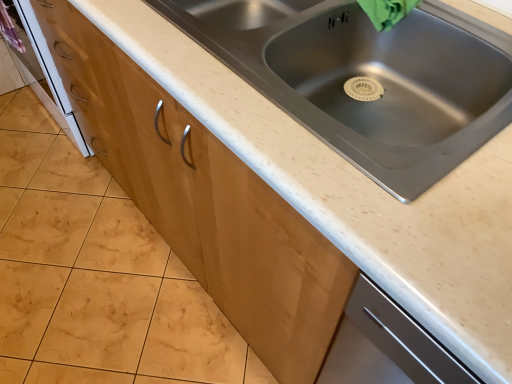
Question: Is matte wood cabinet at center surrounding white glossy oven at lower left?

Choices:
 (A) yes
 (B) no

Answer: (B)

Question: Is matte wood cabinet at center beside white glossy oven at lower left?

Choices:
 (A) no
 (B) yes

Answer: (A)

Question: Is matte wood cabinet at center behind white glossy oven at lower left?

Choices:
 (A) no
 (B) yes

Answer: (A)

Question: Is matte wood cabinet at center bigger than white glossy oven at lower left?

Choices:
 (A) yes
 (B) no

Answer: (B)

Question: Would you say matte wood cabinet at center is outside white glossy oven at lower left?

Choices:
 (A) yes
 (B) no

Answer: (A)

Question: From a real-world perspective, does matte wood cabinet at center sit lower than white glossy oven at lower left?

Choices:
 (A) yes
 (B) no

Answer: (A)

Question: Does white glossy oven at lower left appear on the right side of stainless steel sink at center?

Choices:
 (A) yes
 (B) no

Answer: (B)

Question: Is white glossy oven at lower left to the left of stainless steel sink at center from the viewer's perspective?

Choices:
 (A) yes
 (B) no

Answer: (A)

Question: Is white glossy oven at lower left located outside stainless steel sink at center?

Choices:
 (A) no
 (B) yes

Answer: (B)

Question: Would you say white glossy oven at lower left contains stainless steel sink at center?

Choices:
 (A) yes
 (B) no

Answer: (B)

Question: Is white glossy oven at lower left further to camera compared to stainless steel sink at center?

Choices:
 (A) no
 (B) yes

Answer: (B)

Question: From a real-world perspective, is white glossy oven at lower left physically below stainless steel sink at center?

Choices:
 (A) no
 (B) yes

Answer: (B)

Question: Would you consider stainless steel sink at center to be distant from matte wood cabinet at center?

Choices:
 (A) no
 (B) yes

Answer: (A)